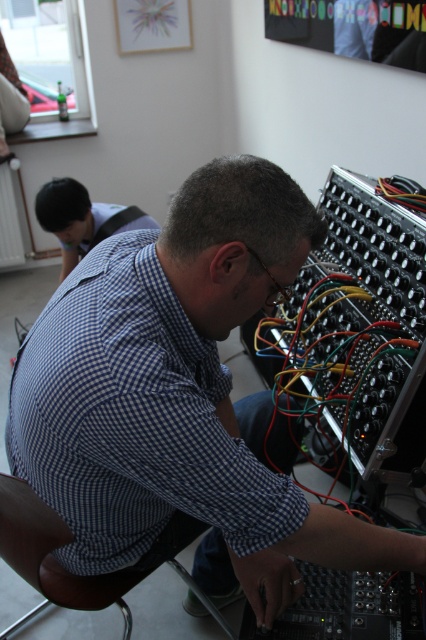
You are a visitor in the room and want to sit down. You see the brown leather chair at lower left and the blue checkered shirt at upper left. Which object is taller and can you sit on it?

The brown leather chair at lower left is much taller than the blue checkered shirt at upper left. You can sit on the brown leather chair at lower left.

You are standing in the room and want to sit down. There is a brown leather chair at lower left and a blue checkered shirt at upper left. Which object is closer to the floor?

The brown leather chair at lower left is closer to the floor since it is positioned below the blue checkered shirt at upper left.